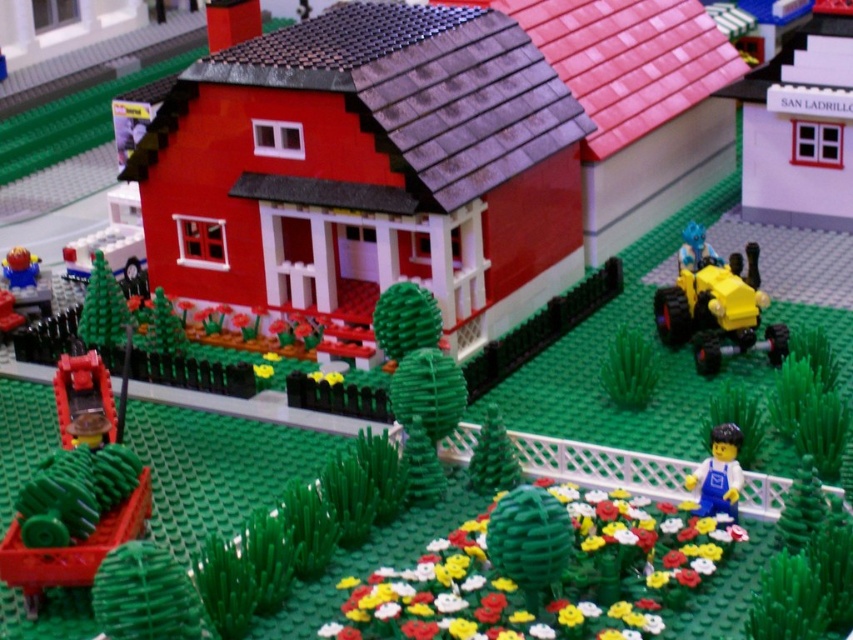
You are a Lego figure trying to reach the blue overalls figure at lower right and the smooth plastic minifigure at lower left. Which one is closer to you if you are standing at the center of the yard?

The blue overalls figure at lower right is closer to you because it is in front of the smooth plastic minifigure at lower left, meaning it is positioned nearer to your current location at the center of the yard.

You are a Lego figure trying to reach the yellow rubber tractor at right. You are currently standing next to the smooth plastic minifigure at lower left. Which direction should you move to get to the tractor?

You should move to the right from the smooth plastic minifigure at lower left to reach the yellow rubber tractor at right since the tractor is positioned to the right side of the scene.

You are a Lego figure standing in front of the red house with a black tiled roof. You need to move the yellow rubber tractor at right to a new location. What are the coordinates where you should place it?

The yellow rubber tractor at right should be placed at coordinates point (715, 305) as specified in the description.